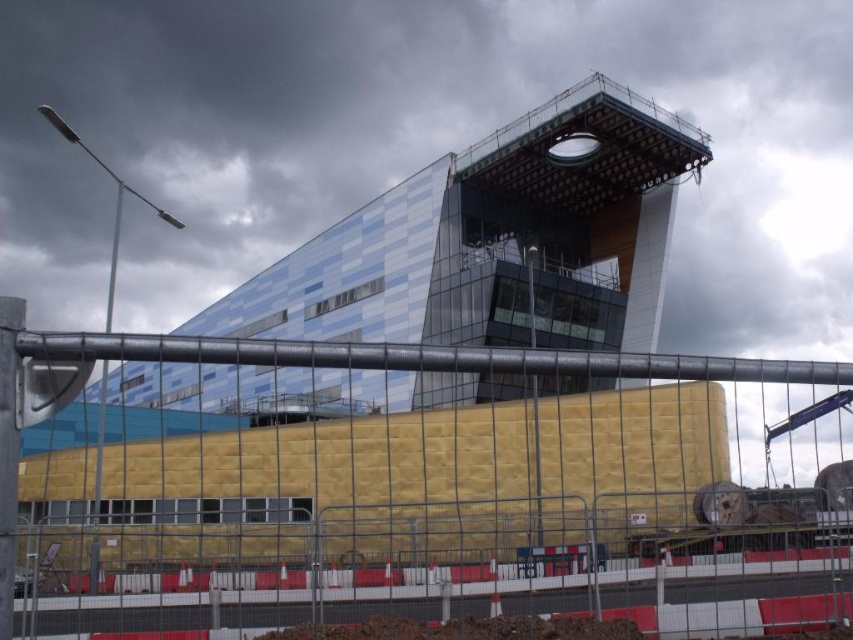
Between blue glass building at upper center and yellow insulation board at center, which one is positioned higher?

Positioned higher is yellow insulation board at center.

Does blue glass building at upper center appear over yellow insulation board at center?

No, blue glass building at upper center is not above yellow insulation board at center.

Is point (259, 401) less distant than point (698, 364)?

No, (259, 401) is behind (698, 364).

Locate an element on the screen. This screenshot has width=853, height=640. blue glass building at upper center is located at coordinates (496, 241).